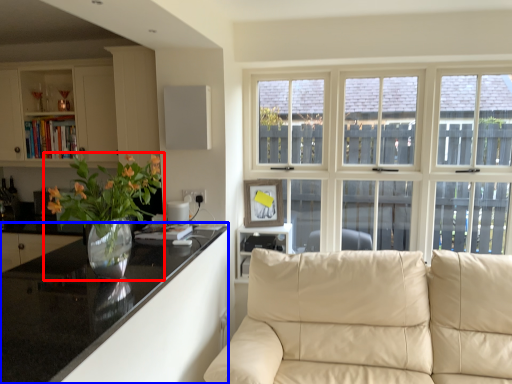
Question: Among these objects, which one is farthest to the camera, houseplant (highlighted by a red box) or countertop (highlighted by a blue box)?

Choices:
 (A) houseplant
 (B) countertop

Answer: (A)